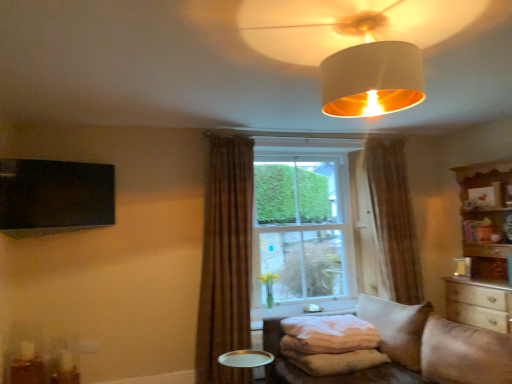
The image size is (512, 384). Find the location of `free spot above white fabric lampshade at upper center (from a real-world perspective)`. free spot above white fabric lampshade at upper center (from a real-world perspective) is located at coordinates (368, 18).